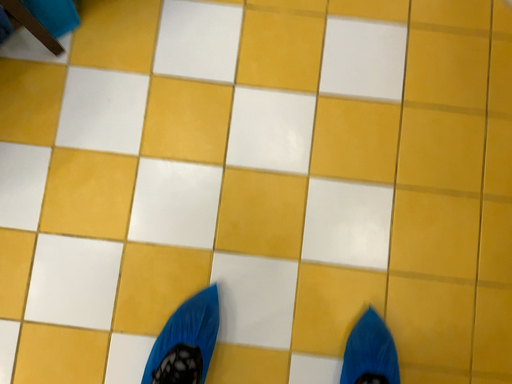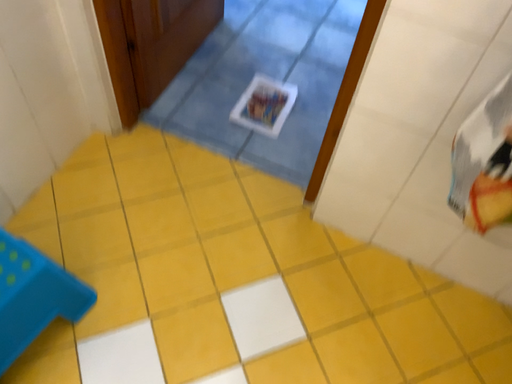
Question: How did the camera likely rotate when shooting the video?

Choices:
 (A) rotated downward
 (B) rotated upward

Answer: (B)